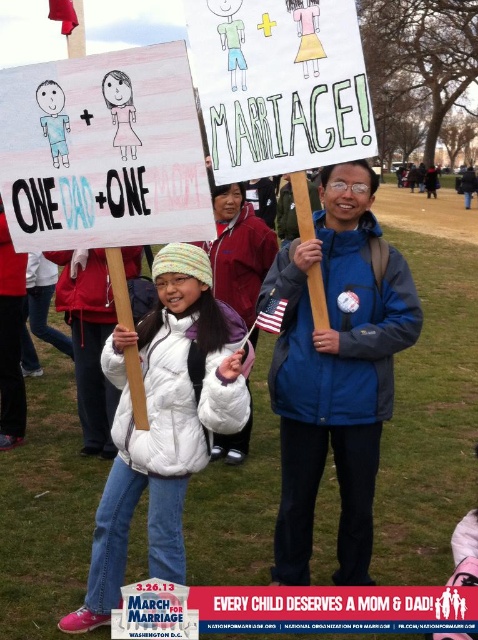
Question: Is blue fabric jacket at center wider than white puffy coat at center?

Choices:
 (A) no
 (B) yes

Answer: (A)

Question: Which object appears farthest from the camera in this image?

Choices:
 (A) blue fabric jacket at center
 (B) white puffy coat at center

Answer: (A)

Question: Can you confirm if blue fabric jacket at center is positioned to the right of white puffy coat at center?

Choices:
 (A) no
 (B) yes

Answer: (B)

Question: Is blue fabric jacket at center positioned behind white puffy coat at center?

Choices:
 (A) no
 (B) yes

Answer: (B)